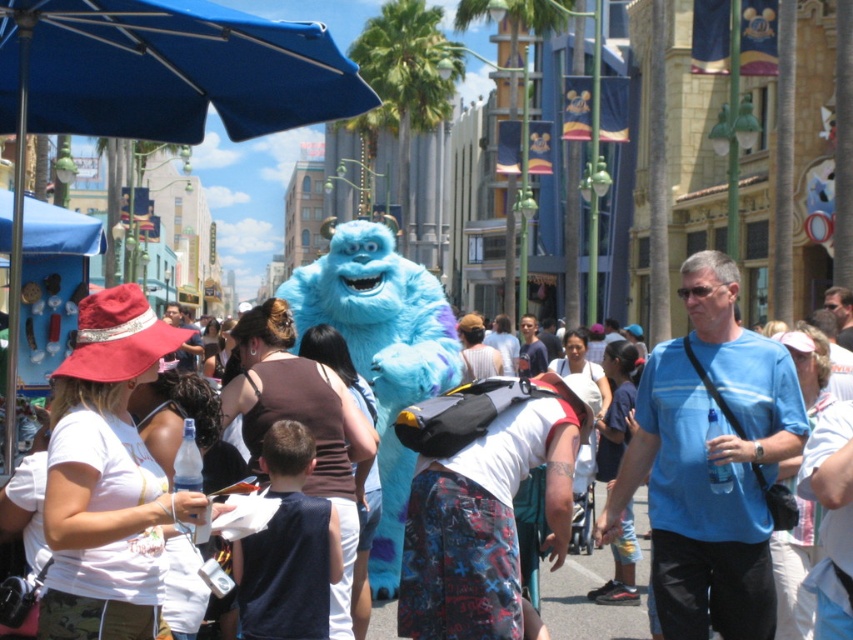
Who is positioned more to the left, white matte hat at left or fuzzy blue costume at center?

white matte hat at left is more to the left.

At what (x,y) coordinates should I click in order to perform the action: click on white matte hat at left. Please return your answer as a coordinate pair (x, y). This screenshot has height=640, width=853. Looking at the image, I should click on (107, 477).

Image resolution: width=853 pixels, height=640 pixels. Find the location of `white matte hat at left`. white matte hat at left is located at coordinates (107, 477).

Can you confirm if blue fabric umbrella at upper left is thinner than white matte hat at left?

Indeed, blue fabric umbrella at upper left has a lesser width compared to white matte hat at left.

Is point (192, 115) positioned before point (122, 609)?

No.

This screenshot has height=640, width=853. Describe the element at coordinates (157, 84) in the screenshot. I see `blue fabric umbrella at upper left` at that location.

At what (x,y) coordinates should I click in order to perform the action: click on blue fabric umbrella at upper left. Please return your answer as a coordinate pair (x, y). This screenshot has width=853, height=640. Looking at the image, I should click on (157, 84).

Between blue fabric umbrella at upper left and blue cotton shirt at center, which one appears on the left side from the viewer's perspective?

Positioned to the left is blue fabric umbrella at upper left.

Does point (24, 145) come closer to viewer compared to point (601, 531)?

Yes, point (24, 145) is in front of point (601, 531).

Find the location of `blue fabric umbrella at upper left`. blue fabric umbrella at upper left is located at coordinates (157, 84).